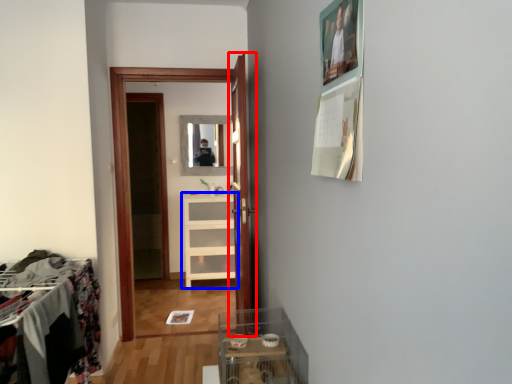
Question: Which point is further to the camera, door (highlighted by a red box) or cabinetry (highlighted by a blue box)?

Choices:
 (A) door
 (B) cabinetry

Answer: (B)